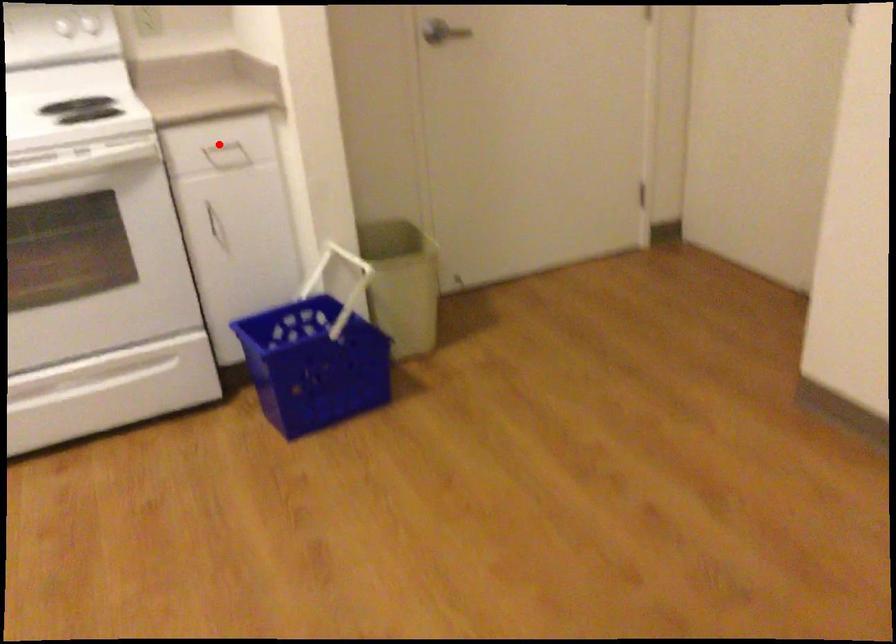
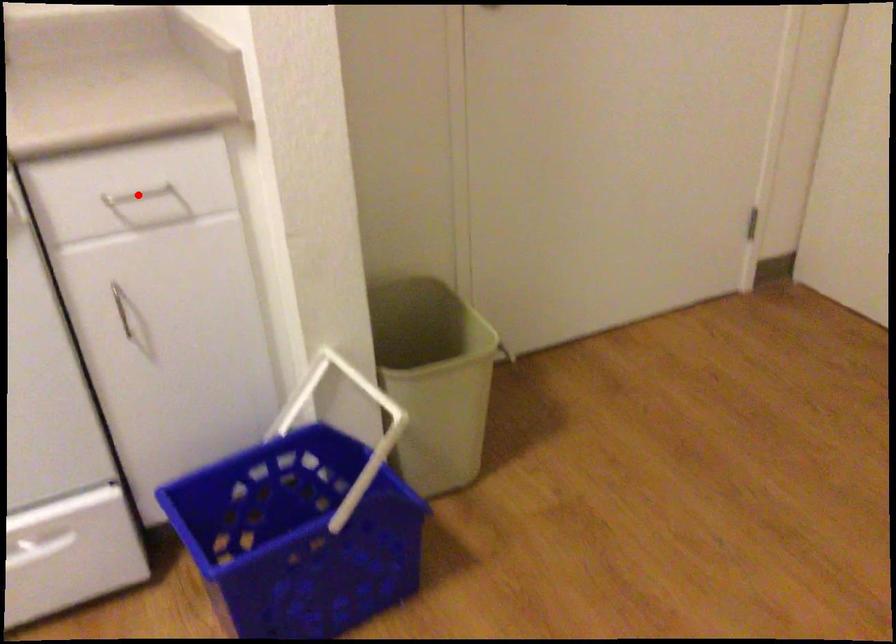
I am providing you with two images of the same scene from different viewpoints. A red point is marked on the first image and another point is marked on the second image. Do the highlighted points in image1 and image2 indicate the same real-world spot?

Yes